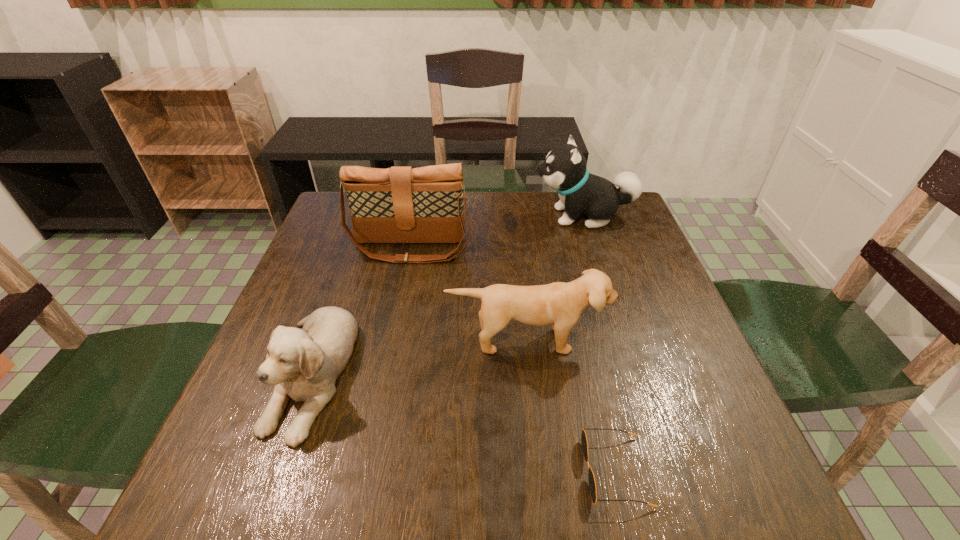
Identify the location of vacant space located on the front-facing side of the shortest object. This screenshot has height=540, width=960. (517, 471).

You are a GUI agent. You are given a task and a screenshot of the screen. Output one action in this format:
    pyautogui.click(x=<x>, y=<y>)
    Task: Click on the vacant area located on the front-facing side of the shortest object
    Image resolution: width=960 pixels, height=540 pixels.
    Given the screenshot: What is the action you would take?
    pyautogui.click(x=420, y=471)

Where is `vacant space situated 0.380m on the front-facing side of the shortest object`? The image size is (960, 540). vacant space situated 0.380m on the front-facing side of the shortest object is located at coordinates (353, 471).

This screenshot has width=960, height=540. I want to click on puppy at the far edge, so click(x=565, y=170).

The width and height of the screenshot is (960, 540). I want to click on shoulder bag located in the far edge section of the desktop, so click(401, 204).

Where is `object located in the near edge section of the desktop`? This screenshot has width=960, height=540. object located in the near edge section of the desktop is located at coordinates (592, 485).

Identify the location of shoulder bag that is at the left edge. (401, 204).

The image size is (960, 540). What are the coordinates of `puppy located in the left edge section of the desktop` in the screenshot? It's located at 303,364.

Identify the location of object that is at the right edge. The width and height of the screenshot is (960, 540). (565, 170).

Identify the location of object that is at the far left corner. The height and width of the screenshot is (540, 960). (401, 204).